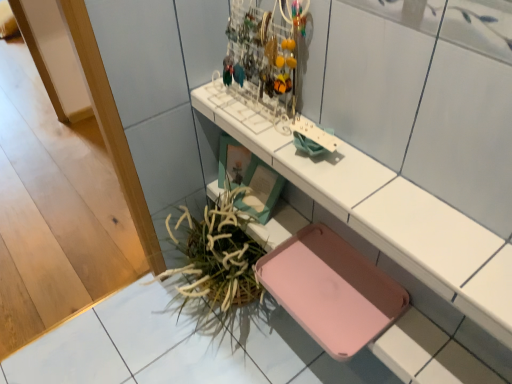
Question: Is green leafy plant at lower left inside or outside of pink plastic tray at upper center?

Choices:
 (A) inside
 (B) outside

Answer: (B)

Question: From their relative heights in the image, would you say green leafy plant at lower left is taller or shorter than pink plastic tray at upper center?

Choices:
 (A) short
 (B) tall

Answer: (B)

Question: Is green leafy plant at lower left to the left or to the right of pink plastic tray at upper center in the image?

Choices:
 (A) right
 (B) left

Answer: (B)

Question: From the image's perspective, is pink plastic tray at upper center positioned above or below green leafy plant at lower left?

Choices:
 (A) above
 (B) below

Answer: (A)

Question: Is point (245, 137) positioned closer to the camera than point (188, 218)?

Choices:
 (A) closer
 (B) farther

Answer: (A)

Question: Is pink plastic tray at upper center to the left or to the right of green leafy plant at lower left in the image?

Choices:
 (A) right
 (B) left

Answer: (A)

Question: In terms of height, does pink plastic tray at upper center look taller or shorter compared to green leafy plant at lower left?

Choices:
 (A) tall
 (B) short

Answer: (B)